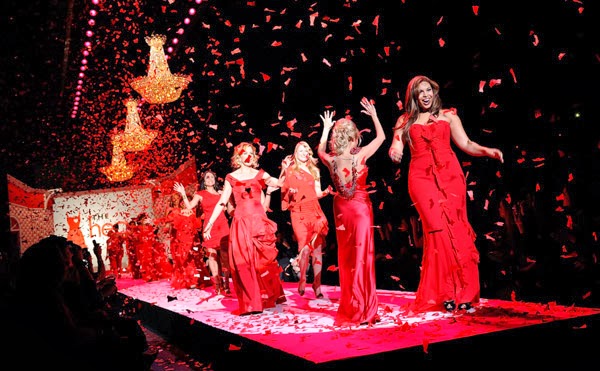
Find the location of a particular element. stage is located at coordinates (332, 329).